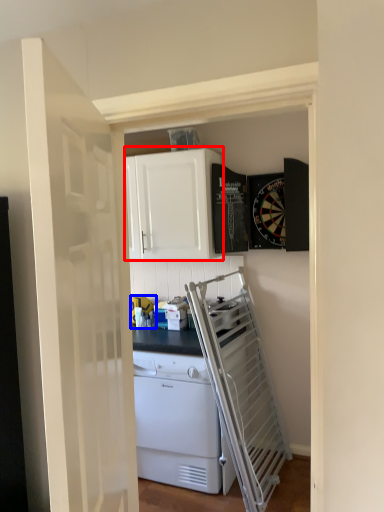
Question: Which object appears closest to the camera in this image, cabinetry (highlighted by a red box) or appliance (highlighted by a blue box)?

Choices:
 (A) cabinetry
 (B) appliance

Answer: (A)